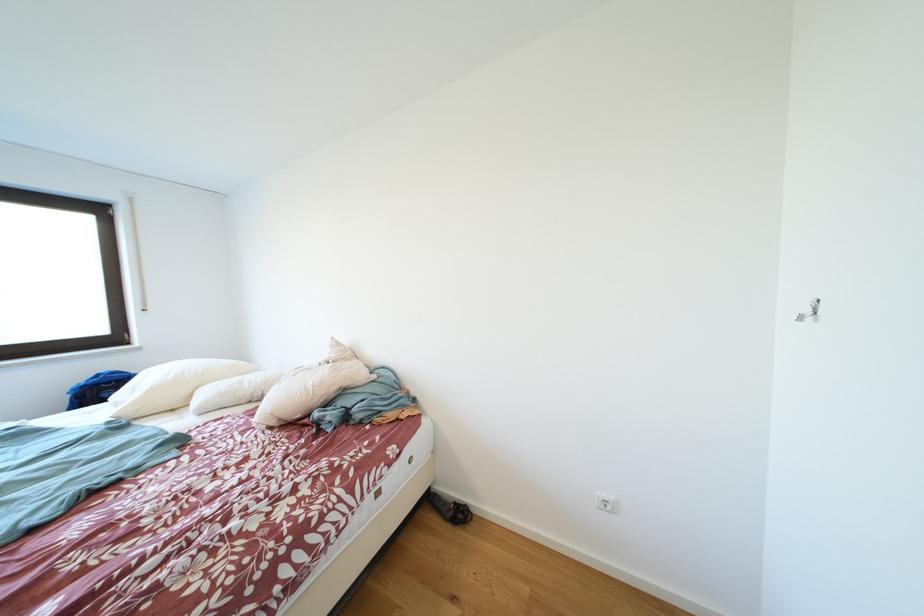
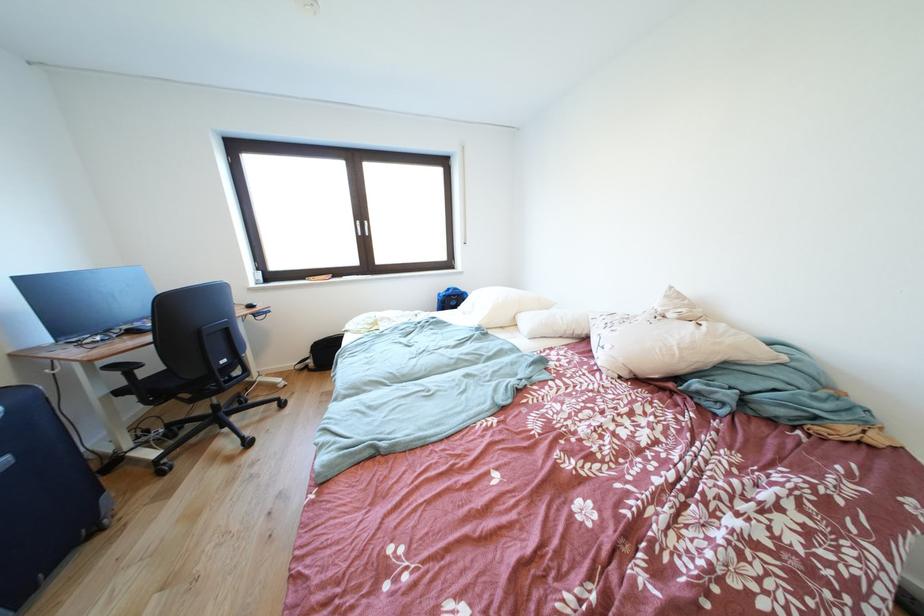
Question: The images are taken continuously from a first-person perspective. In which direction is your viewpoint rotating?

Choices:
 (A) Left
 (B) Right
 (C) Up
 (D) Down

Answer: (A)